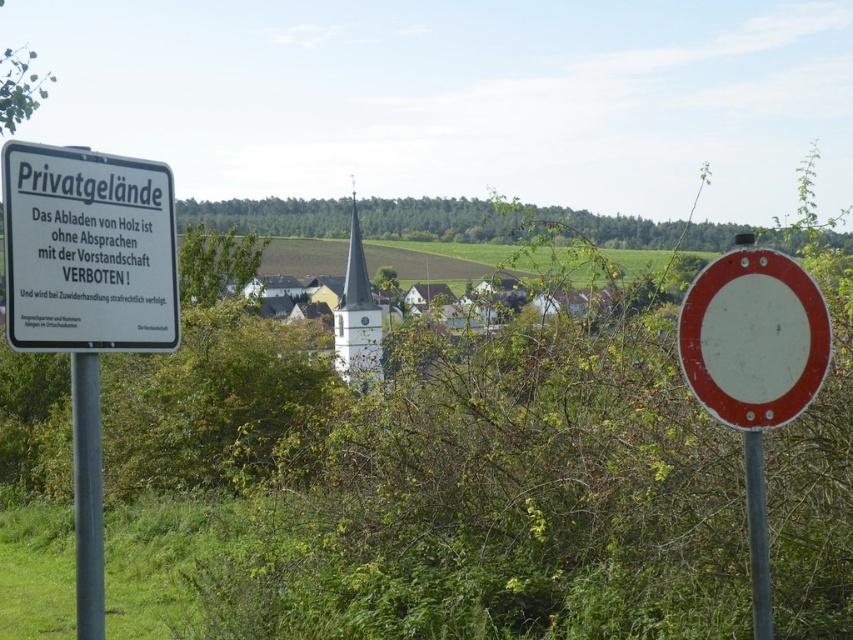
Question: Does white plastic sign at upper left have a smaller size compared to metallic pole at left?

Choices:
 (A) yes
 (B) no

Answer: (B)

Question: Among these objects, which one is farthest from the camera?

Choices:
 (A) metallic pole at center
 (B) metallic pole at left

Answer: (A)

Question: Does white matte circle at center have a lesser width compared to metallic pole at center?

Choices:
 (A) yes
 (B) no

Answer: (B)

Question: Which of the following is the farthest from the observer?

Choices:
 (A) (76, 561)
 (B) (74, 291)

Answer: (A)

Question: Which object is the farthest from the white matte circle at center?

Choices:
 (A) metallic pole at left
 (B) metallic pole at center
 (C) white plastic sign at upper left

Answer: (A)

Question: Considering the relative positions of metallic pole at left and metallic pole at center in the image provided, where is metallic pole at left located with respect to metallic pole at center?

Choices:
 (A) above
 (B) below

Answer: (A)